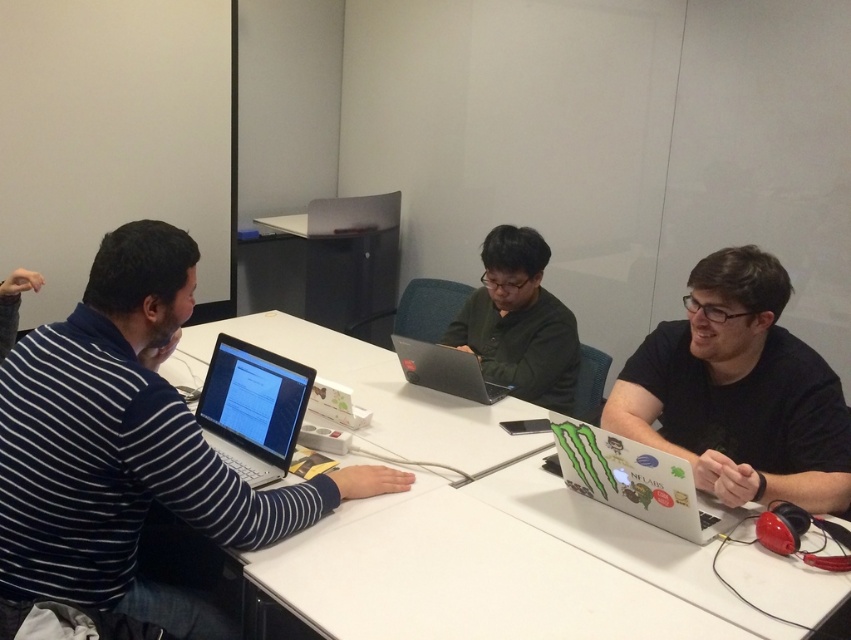
You are a photographer setting up a camera in the office scene. The camera is positioned at the edge of the table. You want to ensure that the camera is exactly 1.2 meters away from the white glossy table at center to capture the best lighting. Is the current distance sufficient?

The white glossy table at center and camera are 1.31 meters apart from each other. Since 1.31 meters is greater than the desired 1.2 meters, the camera is slightly too far away. To achieve the optimal distance, you should move the camera about 11 centimeters closer to the table.

What is the location of the point with coordinates (501, 566) in the image?

The point with coordinates (501, 566) is located on the white glossy table at center.

You are organizing a meeting and need to place a 1.2 meter wide presentation board on the table. Given the white glossy table at center and the white glossy laptop at right, can the presentation board fit on the table without overlapping the laptop?

The white glossy table at center is wider than the white glossy laptop at right, so the 1.2 meter wide presentation board may fit on the table. However, the exact placement and spacing between the laptop and other items would need to be considered to ensure it doesn not overlap.